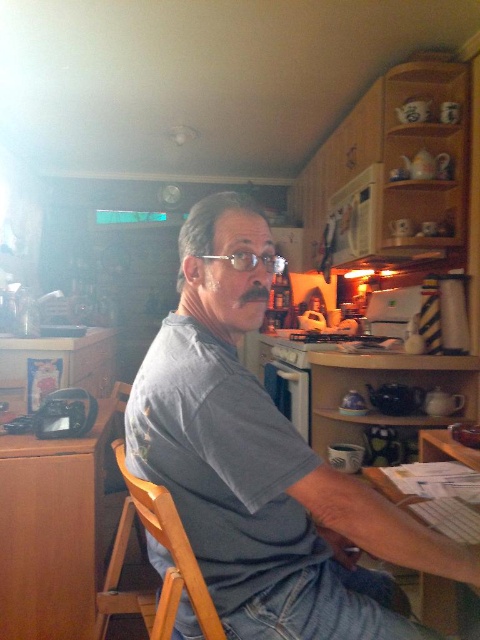
Does gray cotton shirt at center appear on the right side of brown wood table at lower left?

Correct, you'll find gray cotton shirt at center to the right of brown wood table at lower left.

Can you confirm if gray cotton shirt at center is taller than brown wood table at lower left?

Indeed, gray cotton shirt at center has a greater height compared to brown wood table at lower left.

The image size is (480, 640). What do you see at coordinates (242, 454) in the screenshot?
I see `gray cotton shirt at center` at bounding box center [242, 454].

You are a GUI agent. You are given a task and a screenshot of the screen. Output one action in this format:
    pyautogui.click(x=<x>, y=<y>)
    Task: Click on the gray cotton shirt at center
    The width and height of the screenshot is (480, 640).
    Given the screenshot: What is the action you would take?
    pyautogui.click(x=242, y=454)

Which is in front, point (440, 433) or point (201, 259)?

Point (201, 259)

Identify the location of wooden desk at lower right. This screenshot has width=480, height=640. pos(439,604).

The image size is (480, 640). I want to click on wooden desk at lower right, so click(439, 604).

Can you confirm if gray cotton shirt at center is taller than wooden desk at lower right?

Yes, gray cotton shirt at center is taller than wooden desk at lower right.

Who is higher up, gray cotton shirt at center or wooden desk at lower right?

gray cotton shirt at center is above.

Where is `gray cotton shirt at center`? gray cotton shirt at center is located at coordinates (242, 454).